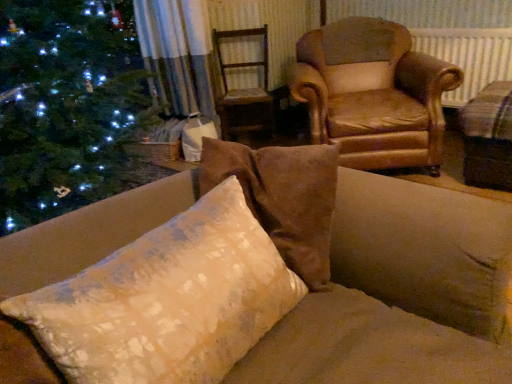
Question: Is the depth of textured cream pillow at center greater than that of beige fabric cushion at right?

Choices:
 (A) no
 (B) yes

Answer: (A)

Question: Considering the relative sizes of textured cream pillow at center and beige fabric cushion at right in the image provided, is textured cream pillow at center shorter than beige fabric cushion at right?

Choices:
 (A) yes
 (B) no

Answer: (A)

Question: Can you confirm if textured cream pillow at center is bigger than beige fabric cushion at right?

Choices:
 (A) yes
 (B) no

Answer: (B)

Question: Is textured cream pillow at center at the right side of beige fabric cushion at right?

Choices:
 (A) yes
 (B) no

Answer: (B)

Question: Is textured cream pillow at center positioned beyond the bounds of beige fabric cushion at right?

Choices:
 (A) no
 (B) yes

Answer: (B)

Question: Looking at the image, does textured cream pillow at center seem bigger or smaller compared to beige fabric cushion at right?

Choices:
 (A) big
 (B) small

Answer: (B)

Question: From a real-world perspective, relative to beige fabric cushion at right, is textured cream pillow at center vertically above or below?

Choices:
 (A) below
 (B) above

Answer: (B)

Question: Looking at their shapes, would you say textured cream pillow at center is wider or thinner than beige fabric cushion at right?

Choices:
 (A) thin
 (B) wide

Answer: (A)

Question: From the image's perspective, is textured cream pillow at center located above or below beige fabric cushion at right?

Choices:
 (A) below
 (B) above

Answer: (A)

Question: Considering their positions, is white plastic radiator at upper right located in front of or behind wooden swivel chair at center?

Choices:
 (A) front
 (B) behind

Answer: (A)

Question: Do you think white plastic radiator at upper right is within wooden swivel chair at center, or outside of it?

Choices:
 (A) outside
 (B) inside

Answer: (A)

Question: Considering the positions of point (461, 104) and point (263, 89), is point (461, 104) closer or farther from the camera than point (263, 89)?

Choices:
 (A) closer
 (B) farther

Answer: (A)

Question: In the image, is white plastic radiator at upper right on the left side or the right side of wooden swivel chair at center?

Choices:
 (A) right
 (B) left

Answer: (A)

Question: Is wooden swivel chair at center inside or outside of beige fabric cushion at right?

Choices:
 (A) inside
 (B) outside

Answer: (B)

Question: In the image, is wooden swivel chair at center positioned in front of or behind beige fabric cushion at right?

Choices:
 (A) front
 (B) behind

Answer: (B)